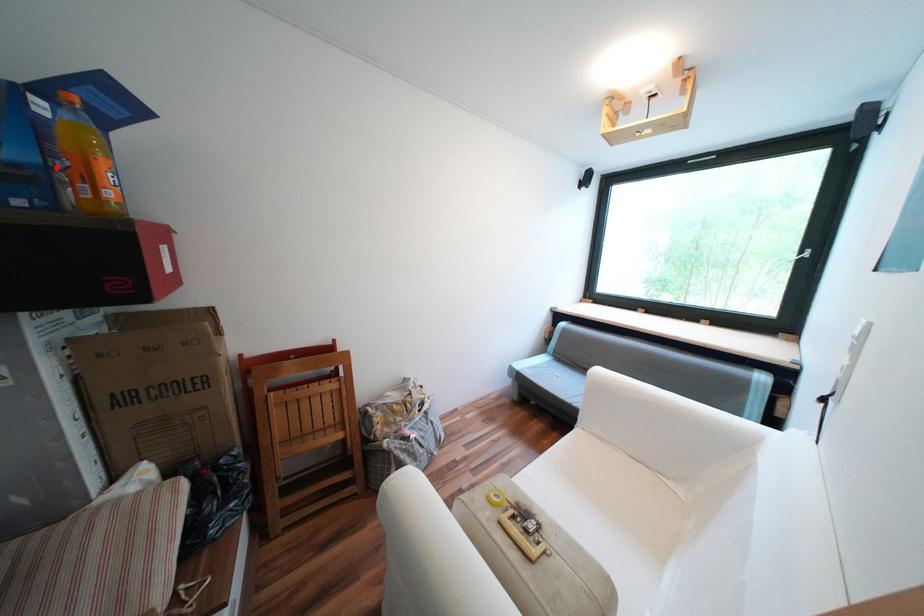
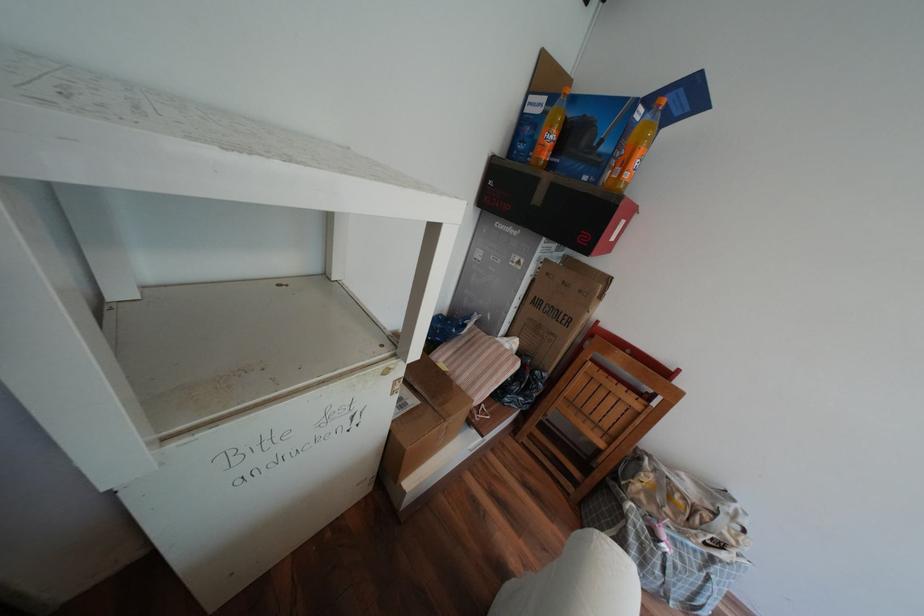
Question: A red point is marked in image1. In image2, is the corresponding 3D point closer to the camera or farther? Reply with the corresponding letter.

Choices:
 (A) The corresponding 3D point is closer.
 (B) The corresponding 3D point is farther.

Answer: (A)